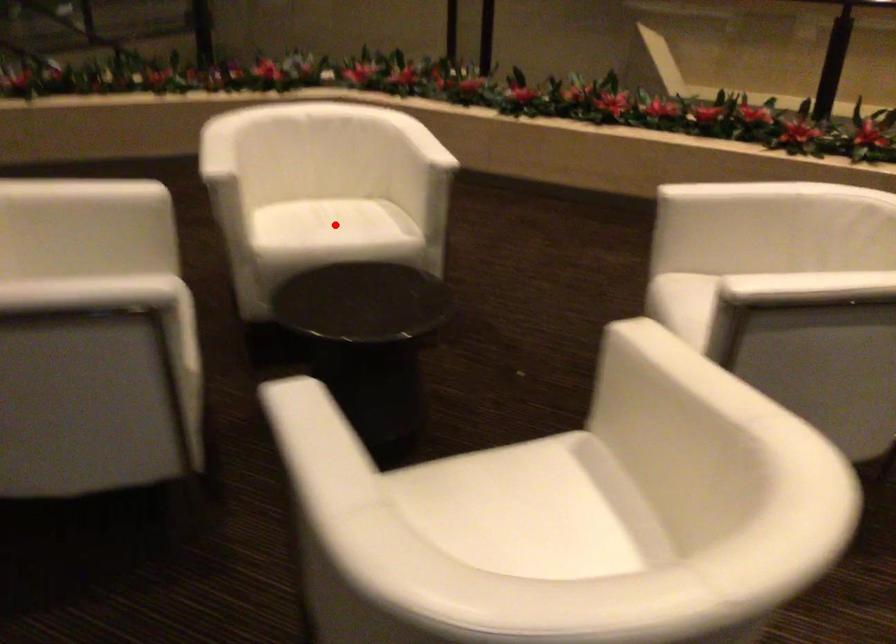
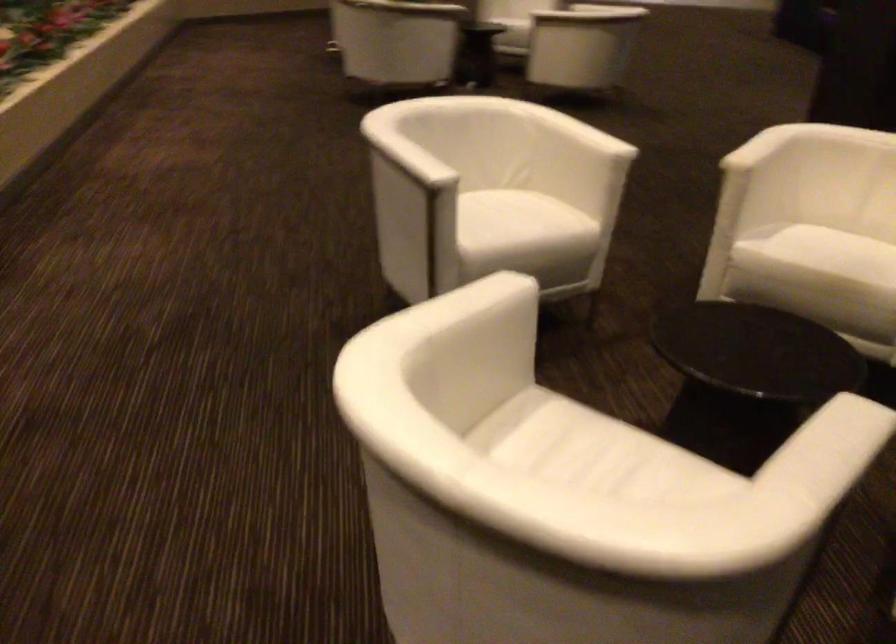
Question: I am providing you with two images of the same scene from different viewpoints. Given a red point in image1, look at the same physical point in image2. Is it:

Choices:
 (A) Closer to the viewpoint
 (B) Farther from the viewpoint

Answer: (A)